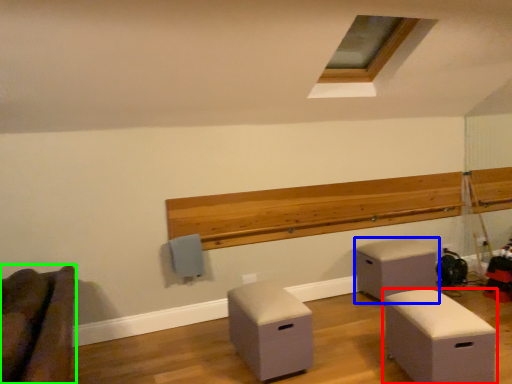
Question: Which object is the closest to the furniture (highlighted by a red box)? Choose among these: furniture (highlighted by a blue box) or furniture (highlighted by a green box).

Choices:
 (A) furniture
 (B) furniture

Answer: (A)